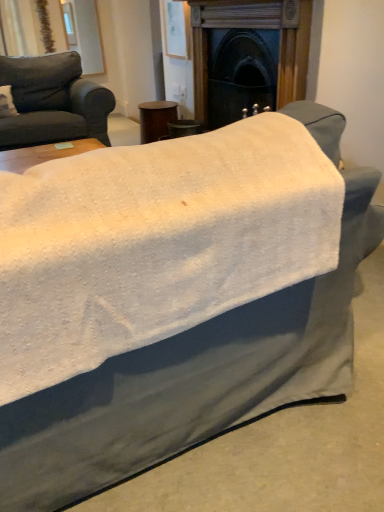
The width and height of the screenshot is (384, 512). Describe the element at coordinates (52, 101) in the screenshot. I see `matte gray couch at left` at that location.

Locate an element on the screen. Image resolution: width=384 pixels, height=512 pixels. matte gray couch at left is located at coordinates (52, 101).

Is matte gray couch at left inside or outside of dark wood fireplace at center?

matte gray couch at left is not enclosed by dark wood fireplace at center.

Is matte gray couch at left not near dark wood fireplace at center?

That's right, there is a large distance between matte gray couch at left and dark wood fireplace at center.

Find the location of a particular element. fireplace located below the matte gray couch at left (from the image's perspective) is located at coordinates (254, 28).

What's the angular difference between matte gray couch at left and dark wood fireplace at center's facing directions?

There is a 90-degree angle between the facing directions of matte gray couch at left and dark wood fireplace at center.

Consider the image. Does brown wood side table at center contain matte gray couch at left?

No, brown wood side table at center does not contain matte gray couch at left.

Is point (145, 143) positioned behind point (81, 128)?

Yes, point (145, 143) is farther from viewer.

Is brown wood side table at center oriented away from matte gray couch at left?

That's not correct — brown wood side table at center is not looking away from matte gray couch at left.

From a real-world perspective, is dark wood fireplace at center over matte gray couch at left?

Yes, from a real-world perspective, dark wood fireplace at center is above matte gray couch at left.

Considering the positions of objects dark wood fireplace at center and matte gray couch at left in the image provided, who is more to the right, dark wood fireplace at center or matte gray couch at left?

dark wood fireplace at center.

Is the surface of dark wood fireplace at center in direct contact with matte gray couch at left?

No.

Considering the sizes of dark wood fireplace at center and matte gray couch at left in the image, is dark wood fireplace at center taller or shorter than matte gray couch at left?

Clearly, dark wood fireplace at center is taller compared to matte gray couch at left.

Considering the sizes of objects brown wood side table at center and dark wood fireplace at center in the image provided, who is shorter, brown wood side table at center or dark wood fireplace at center?

Standing shorter between the two is brown wood side table at center.

Consider the image. Is brown wood side table at center touching dark wood fireplace at center?

brown wood side table at center is not next to dark wood fireplace at center, and they're not touching.

In the image, is brown wood side table at center positioned in front of or behind dark wood fireplace at center?

Visually, brown wood side table at center is located behind dark wood fireplace at center.

At what (x,y) coordinates should I click in order to perform the action: click on fireplace on the right of brown wood side table at center. Please return your answer as a coordinate pair (x, y). Image resolution: width=384 pixels, height=512 pixels. Looking at the image, I should click on click(x=254, y=28).

Considering the sizes of objects dark wood fireplace at center and brown wood side table at center in the image provided, who is bigger, dark wood fireplace at center or brown wood side table at center?

With larger size is dark wood fireplace at center.

From the picture: Which is farther, (x=277, y=108) or (x=175, y=106)?

Positioned behind is point (x=175, y=106).

Identify the location of fireplace to the right of brown wood side table at center. (254, 28).

Between dark wood fireplace at center and brown wood side table at center, which one is positioned in front?

dark wood fireplace at center.

From a real-world perspective, which object stands above the other?

In real-world perspective, matte gray couch at left is above.

In terms of width, does matte gray couch at left look wider or thinner when compared to brown wood side table at center?

Considering their sizes, matte gray couch at left looks broader than brown wood side table at center.

Between point (66, 134) and point (160, 136), which one is positioned in front?

The point (66, 134) is closer to the camera.

Can you tell me how much matte gray couch at left and brown wood side table at center differ in facing direction?

There is a 89.5-degree angle between the facing directions of matte gray couch at left and brown wood side table at center.

Locate an element on the screen. studio couch on the left of dark wood fireplace at center is located at coordinates (52, 101).

In order to click on studio couch that appears in front of the brown wood side table at center in this screenshot , I will do `click(52, 101)`.

From the picture: From the image, which object appears to be farther from matte gray couch at left, brown wood side table at center or dark wood fireplace at center?

dark wood fireplace at center.

Which object lies further to the anchor point brown wood side table at center, dark wood fireplace at center or matte gray couch at left?

dark wood fireplace at center is further to brown wood side table at center.

Which object lies further to the anchor point dark wood fireplace at center, brown wood side table at center or matte gray couch at left?

Among the two, matte gray couch at left is located further to dark wood fireplace at center.

Based on their spatial positions, is matte gray couch at left or dark wood fireplace at center further from brown wood side table at center?

dark wood fireplace at center is further to brown wood side table at center.

From the image, which object appears to be nearer to matte gray couch at left, dark wood fireplace at center or brown wood side table at center?

brown wood side table at center is positioned closer to the anchor matte gray couch at left.

From the image, which object appears to be nearer to dark wood fireplace at center, matte gray couch at left or brown wood side table at center?

Based on the image, brown wood side table at center appears to be nearer to dark wood fireplace at center.

Identify the location of studio couch between dark wood fireplace at center and brown wood side table at center along the z-axis. Image resolution: width=384 pixels, height=512 pixels. (52, 101).